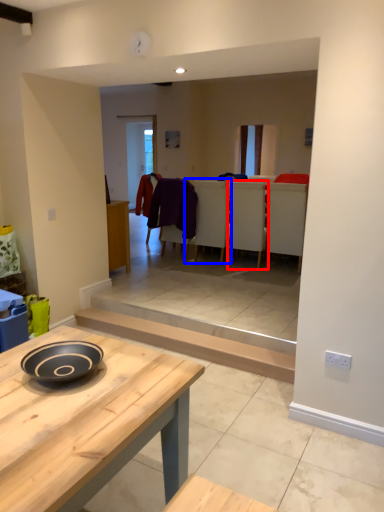
Question: Which object is closer to the camera taking this photo, chair (highlighted by a red box) or armchair (highlighted by a blue box)?

Choices:
 (A) chair
 (B) armchair

Answer: (A)